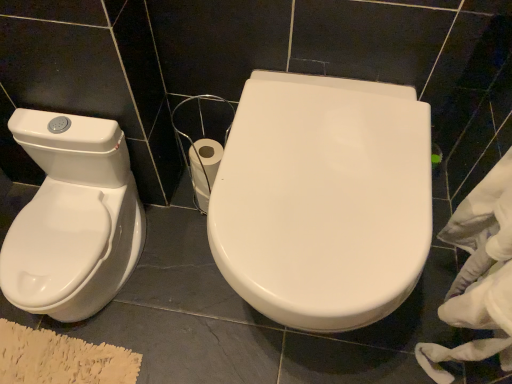
Question: Is white glossy toilet seat at center bigger or smaller than white fabric at right?

Choices:
 (A) small
 (B) big

Answer: (B)

Question: Which is correct: white glossy toilet seat at center is inside white fabric at right, or outside of it?

Choices:
 (A) inside
 (B) outside

Answer: (B)

Question: Which is farther from the white fabric at right?

Choices:
 (A) white glossy toilet seat at center
 (B) white glossy bidet at left

Answer: (B)

Question: Based on their relative distances, which object is nearer to the white fabric at right?

Choices:
 (A) white glossy toilet seat at center
 (B) white glossy bidet at left

Answer: (A)